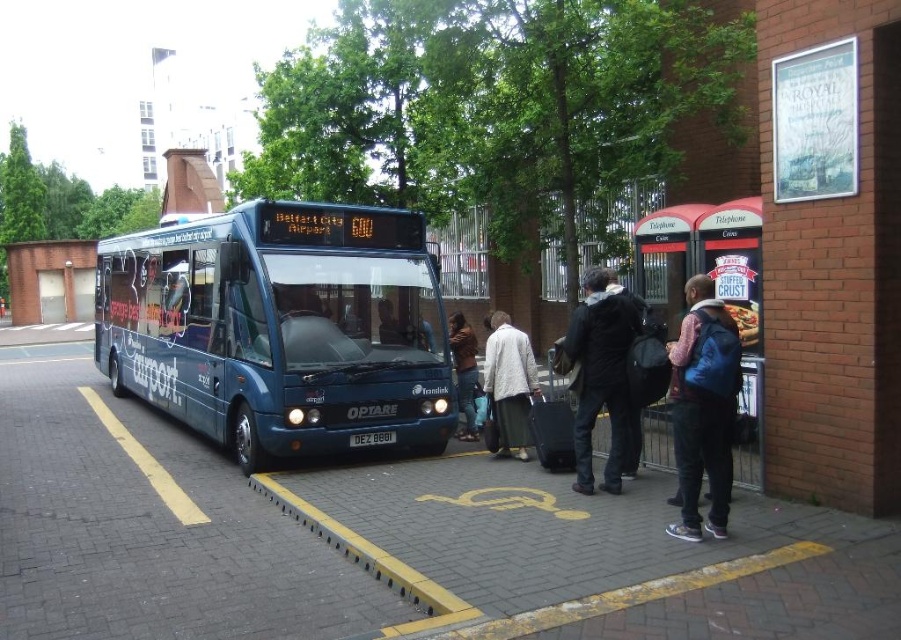
You are a delivery person trying to place a large package between the metallic red phone booth at right and the brown leather jacket at center. Based on their sizes, can you fit the package there?

The metallic red phone booth at right might be wider than brown leather jacket at center, so there might be enough space to fit the package between them if the width difference is sufficient.

You are a delivery person carrying a package that requires a clear path of at least 1.5 meters to maneuver safely. You need to pass between the dark blue jacket at center and the light beige coat at center. Can you safely navigate through this space?

The dark blue jacket at center and light beige coat at center are 1.41 meters apart, which is less than the required 1.5 meters. Therefore, you cannot safely navigate through this space with the package.